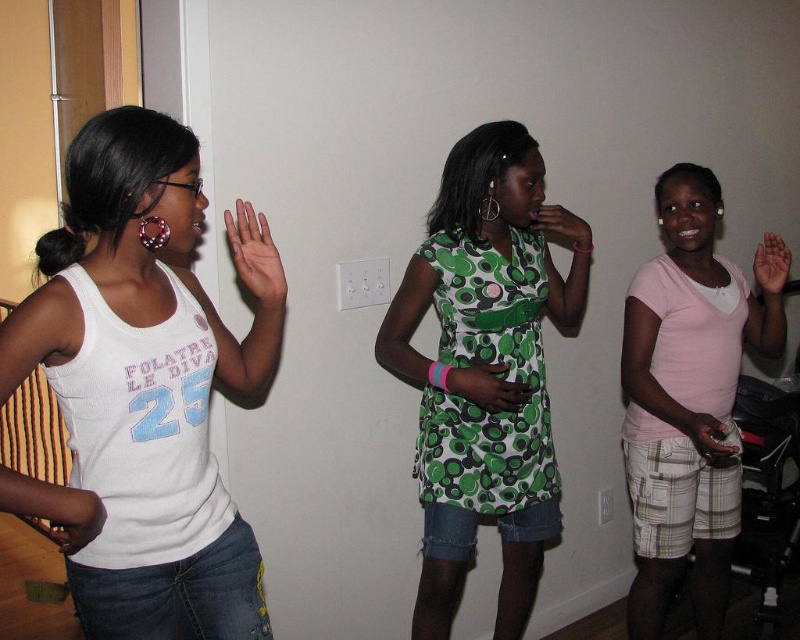
Does point (100, 516) come farther from viewer compared to point (580, 220)?

No, (100, 516) is closer to viewer.

Does white matte hand at lower left have a larger size compared to green fabric hand at center?

No, white matte hand at lower left is not bigger than green fabric hand at center.

The image size is (800, 640). Describe the element at coordinates (73, 516) in the screenshot. I see `white matte hand at lower left` at that location.

Find the location of a particular element. The height and width of the screenshot is (640, 800). white matte hand at lower left is located at coordinates (73, 516).

Is white ribbed tank top at left to the right of green fabric hand at center from the viewer's perspective?

Incorrect, white ribbed tank top at left is not on the right side of green fabric hand at center.

What do you see at coordinates (142, 387) in the screenshot? The width and height of the screenshot is (800, 640). I see `white ribbed tank top at left` at bounding box center [142, 387].

Where is `white ribbed tank top at left`? white ribbed tank top at left is located at coordinates (142, 387).

Image resolution: width=800 pixels, height=640 pixels. What are the coordinates of `white ribbed tank top at left` in the screenshot? It's located at (142, 387).

From the picture: Can you confirm if green dotted dress at center is taller than matte black controller at lower right?

No, green dotted dress at center is not taller than matte black controller at lower right.

Does green dotted dress at center appear on the left side of matte black controller at lower right?

Correct, you'll find green dotted dress at center to the left of matte black controller at lower right.

Between point (496, 408) and point (724, 426), which one is positioned in front?

Point (496, 408) is in front.

The image size is (800, 640). Find the location of `green dotted dress at center`. green dotted dress at center is located at coordinates (488, 387).